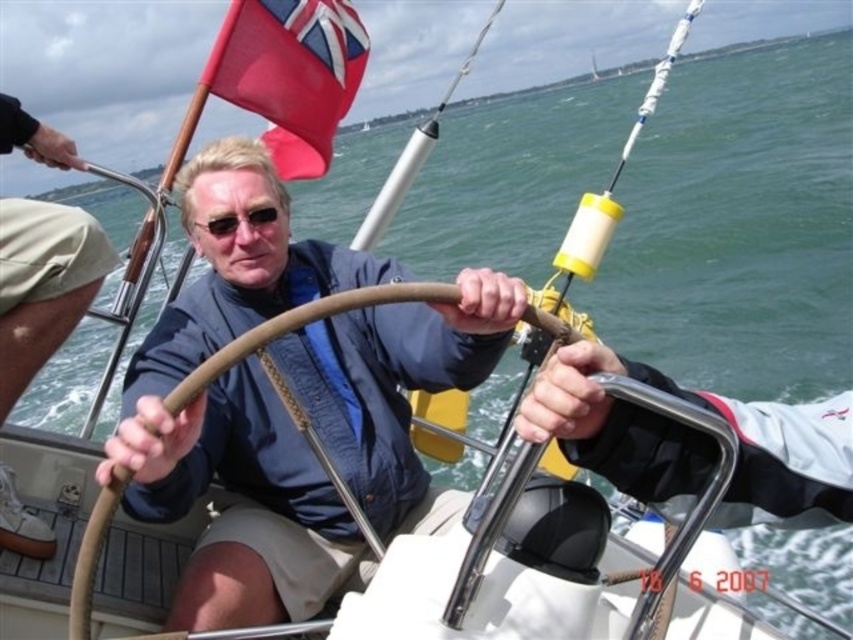
Question: Does khaki shorts at center have a greater width compared to red fabric flag at upper left?

Choices:
 (A) no
 (B) yes

Answer: (B)

Question: Is red fabric flag at upper left to the right of black plastic goggles at center from the viewer's perspective?

Choices:
 (A) yes
 (B) no

Answer: (A)

Question: Which point is farther from the camera taking this photo?

Choices:
 (A) (x=55, y=224)
 (B) (x=231, y=214)

Answer: (B)

Question: Considering the real-world distances, which object is closest to the blue fabric jacket at center?

Choices:
 (A) red fabric flag at upper left
 (B) black plastic goggles at center
 (C) khaki shorts at center

Answer: (B)

Question: Is khaki shorts at center smaller than red fabric flag at upper left?

Choices:
 (A) no
 (B) yes

Answer: (A)

Question: Which of these objects is positioned closest to the black plastic goggles at center?

Choices:
 (A) blue fabric jacket at center
 (B) khaki shorts at center
 (C) red fabric flag at upper left

Answer: (C)